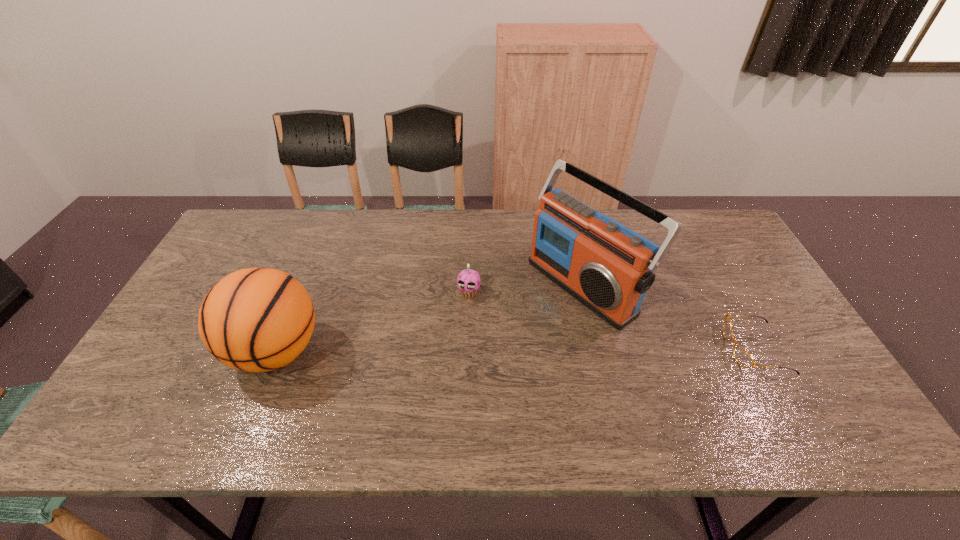
Locate an element on the screen. free space between the third object from left to right and the rightmost object is located at coordinates (670, 316).

At what (x,y) coordinates should I click in order to perform the action: click on vacant point located between the shortest object and the radio receiver. Please return your answer as a coordinate pair (x, y). Looking at the image, I should click on (670, 316).

At what (x,y) coordinates should I click in order to perform the action: click on free space between the leftmost object and the third object from right to left. Please return your answer as a coordinate pair (x, y). The height and width of the screenshot is (540, 960). Looking at the image, I should click on (372, 322).

Where is `free spot between the second object from right to left and the shortest object`? free spot between the second object from right to left and the shortest object is located at coordinates (670, 316).

Where is `vacant area that lies between the radio receiver and the leftmost object`? vacant area that lies between the radio receiver and the leftmost object is located at coordinates (430, 318).

Identify which object is the second nearest to the leftmost object. Please provide its 2D coordinates. Your answer should be formatted as a tuple, i.e. [(x, y)], where the tuple contains the x and y coordinates of a point satisfying the conditions above.

[(608, 267)]

Identify which object is the second nearest to the shortest object. Please provide its 2D coordinates. Your answer should be formatted as a tuple, i.e. [(x, y)], where the tuple contains the x and y coordinates of a point satisfying the conditions above.

[(469, 278)]

Where is `vacant space that satisfies the following two spatial constraints: 1. on the front side of the shortest object; 2. on the front-facing side of the cupcake`? vacant space that satisfies the following two spatial constraints: 1. on the front side of the shortest object; 2. on the front-facing side of the cupcake is located at coordinates (468, 349).

At what (x,y) coordinates should I click in order to perform the action: click on vacant space that satisfies the following two spatial constraints: 1. on the front side of the tallest object; 2. on the front-facing side of the shortest object. Please return your answer as a coordinate pair (x, y). This screenshot has height=540, width=960. Looking at the image, I should click on (600, 349).